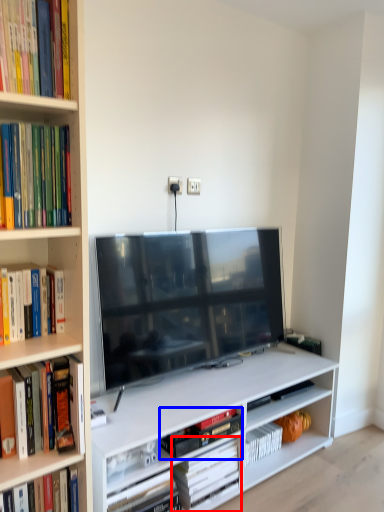
Question: Which point is closer to the camera, book (highlighted by a red box) or book (highlighted by a blue box)?

Choices:
 (A) book
 (B) book

Answer: (B)